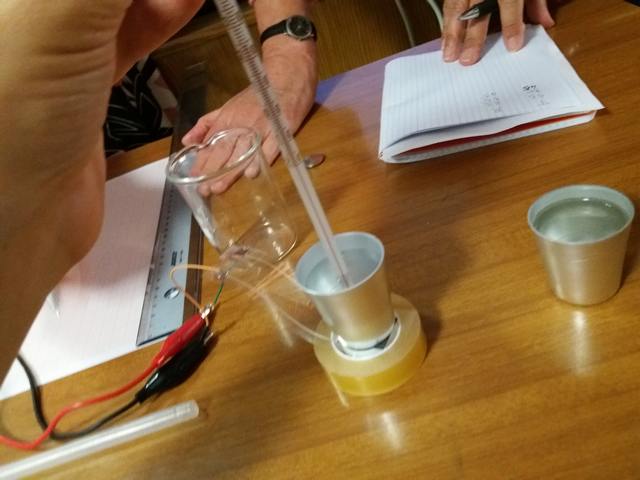
You are a GUI agent. You are given a task and a screenshot of the screen. Output one action in this format:
    pyautogui.click(x=<x>, y=<y>)
    Task: Click on the top of wooden desk
    This screenshot has width=640, height=480.
    Given the screenshot: What is the action you would take?
    pyautogui.click(x=521, y=384)